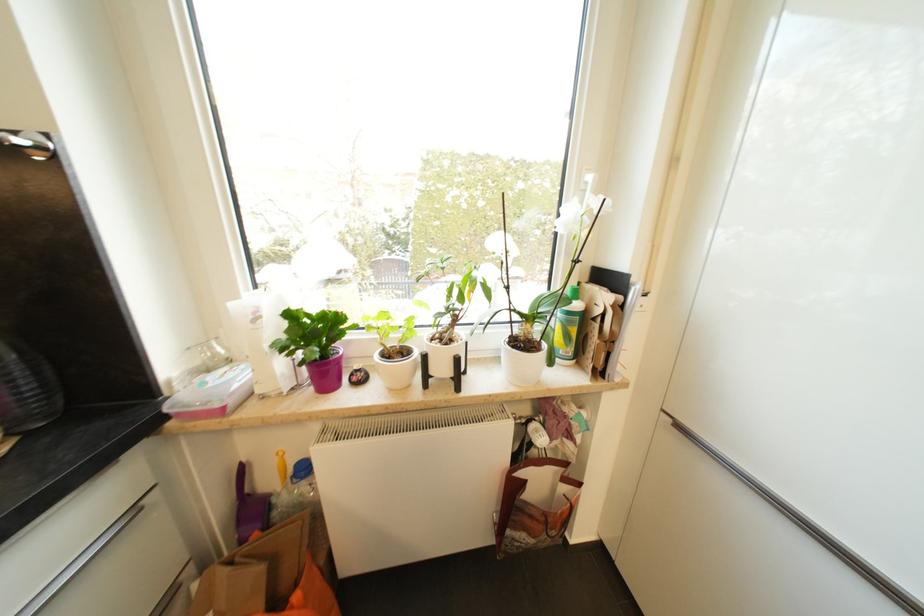
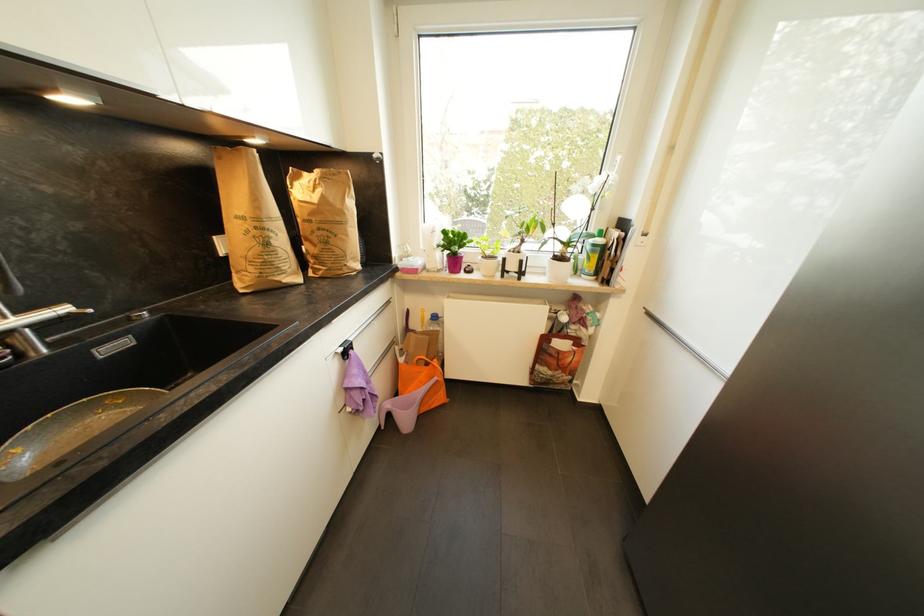
Question: The camera is either moving clockwise (left) or counter-clockwise (right) around the object. The first image is from the beginning of the video and the second image is from the end. Is the camera moving left or right when shooting the video?

Choices:
 (A) Left
 (B) Right

Answer: (B)